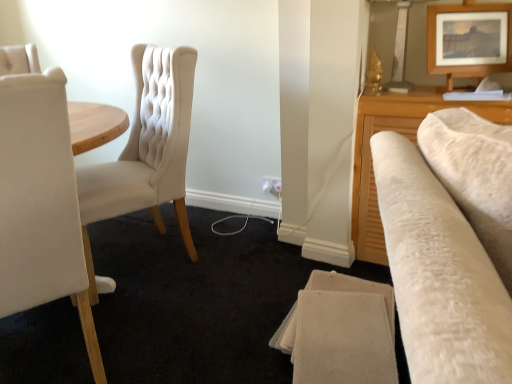
Image resolution: width=512 pixels, height=384 pixels. I want to click on free spot below matte cream fabric chair at left, the 2th chair when ordered from front to back (from a real-world perspective), so click(x=143, y=258).